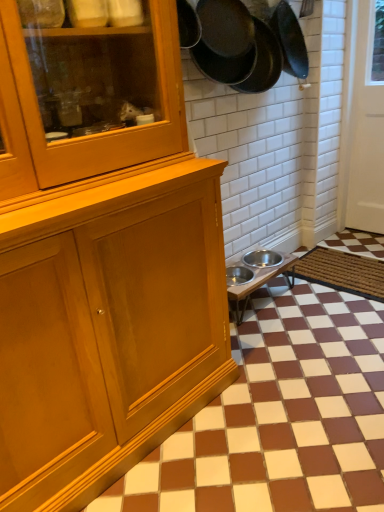
Question: Is white glossy door at right wider than brown matte tile at lower right?

Choices:
 (A) yes
 (B) no

Answer: (B)

Question: Is white glossy door at right thinner than brown matte tile at lower right?

Choices:
 (A) yes
 (B) no

Answer: (A)

Question: From the image's perspective, would you say white glossy door at right is shown under brown matte tile at lower right?

Choices:
 (A) yes
 (B) no

Answer: (B)

Question: Is white glossy door at right behind brown matte tile at lower right?

Choices:
 (A) yes
 (B) no

Answer: (A)

Question: Can you confirm if white glossy door at right is positioned to the left of brown matte tile at lower right?

Choices:
 (A) no
 (B) yes

Answer: (A)

Question: Is white glossy door at right shorter than brown matte tile at lower right?

Choices:
 (A) yes
 (B) no

Answer: (B)

Question: Is the position of black matte frying pan at upper right, placed as the first frying pan when sorted from left to right, less distant than that of brown matte tile at lower right?

Choices:
 (A) no
 (B) yes

Answer: (A)

Question: From the image's perspective, is black matte frying pan at upper right, which ranks as the second frying pan in right-to-left order, located above brown matte tile at lower right?

Choices:
 (A) yes
 (B) no

Answer: (A)

Question: Can you confirm if black matte frying pan at upper right, placed as the first frying pan when sorted from left to right, is taller than brown matte tile at lower right?

Choices:
 (A) yes
 (B) no

Answer: (A)

Question: Is black matte frying pan at upper right, which ranks as the second frying pan in right-to-left order, shorter than brown matte tile at lower right?

Choices:
 (A) no
 (B) yes

Answer: (A)

Question: Is black matte frying pan at upper right, which ranks as the second frying pan in right-to-left order, next to brown matte tile at lower right and touching it?

Choices:
 (A) no
 (B) yes

Answer: (A)

Question: Considering the relative sizes of black matte frying pan at upper right, which ranks as the second frying pan in right-to-left order, and brown matte tile at lower right in the image provided, is black matte frying pan at upper right, which ranks as the second frying pan in right-to-left order, wider than brown matte tile at lower right?

Choices:
 (A) no
 (B) yes

Answer: (A)

Question: From a real-world perspective, is brown woven mat at lower right located higher than dark gray matte frying pan at upper right, the first frying pan when ordered from right to left?

Choices:
 (A) no
 (B) yes

Answer: (A)